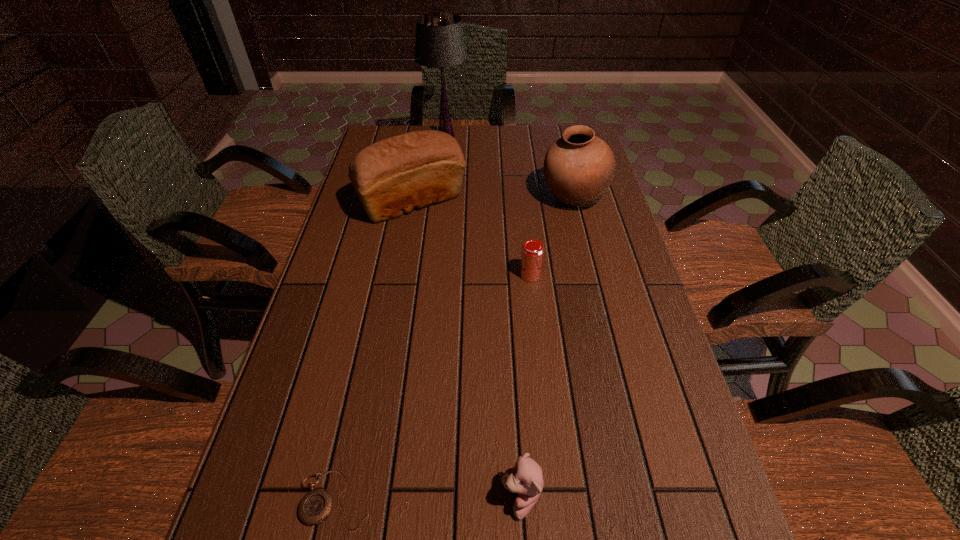
At what (x,y) coordinates should I click in order to perform the action: click on the farthest object. Please return your answer as a coordinate pair (x, y). Looking at the image, I should click on (440, 43).

Locate an element on the screen. This screenshot has width=960, height=540. lampshade is located at coordinates (440, 43).

What are the coordinates of `pottery` in the screenshot? It's located at (579, 167).

At what (x,y) coordinates should I click in order to perform the action: click on bread. Please return your answer as a coordinate pair (x, y). Looking at the image, I should click on (393, 176).

At what (x,y) coordinates should I click in order to perform the action: click on teddy bear. Please return your answer as a coordinate pair (x, y). The height and width of the screenshot is (540, 960). Looking at the image, I should click on coord(525,478).

The height and width of the screenshot is (540, 960). I want to click on beer can, so click(532, 250).

This screenshot has width=960, height=540. Identify the location of pocket watch. (315, 507).

Locate an element on the screen. The height and width of the screenshot is (540, 960). vacant region located 0.340m on the front-facing side of the lampshade is located at coordinates (561, 137).

Locate an element on the screen. This screenshot has height=540, width=960. vacant region located 0.090m on the left of the pottery is located at coordinates (512, 198).

Locate an element on the screen. free space located on the right of the bread is located at coordinates (587, 201).